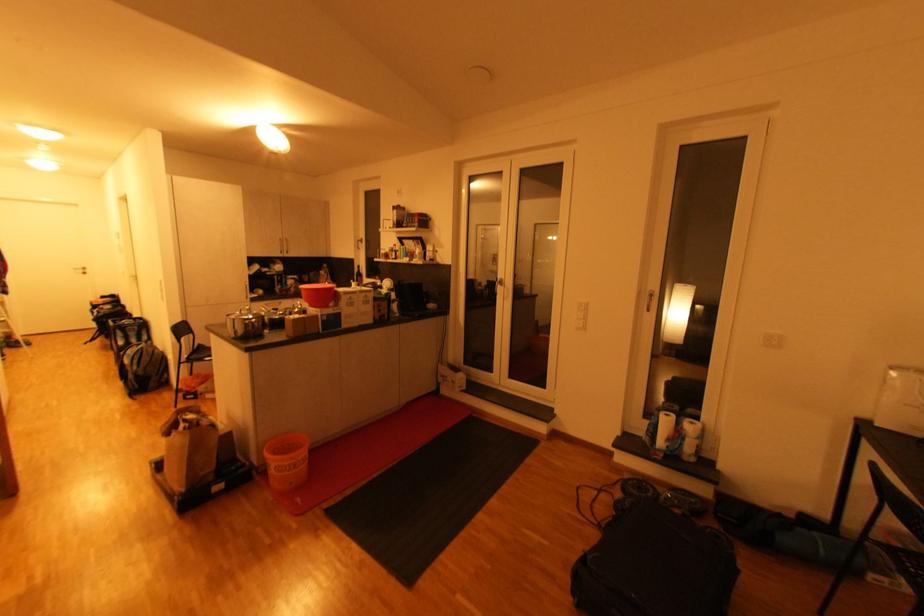
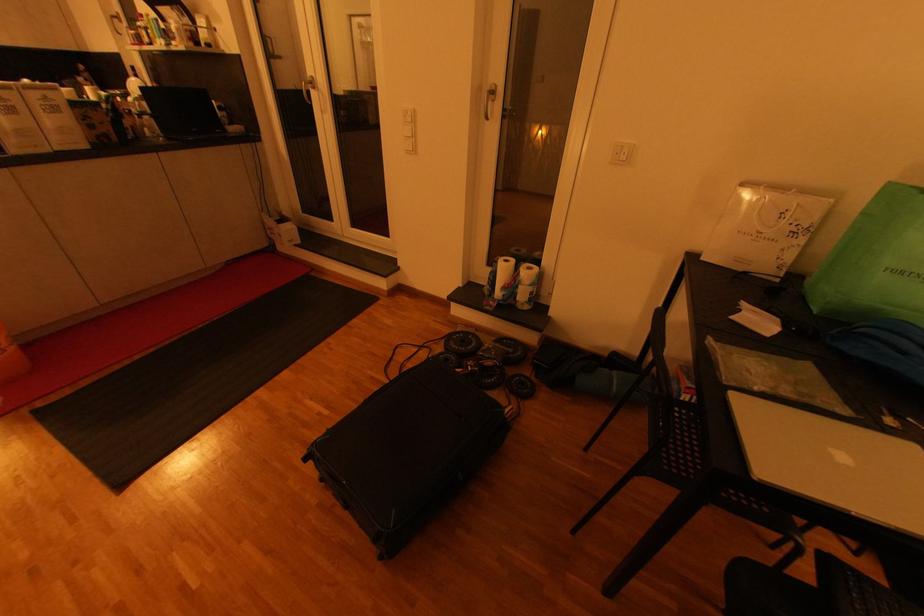
Find the pixel in the second image that matches point (698, 424) in the first image.

(533, 269)